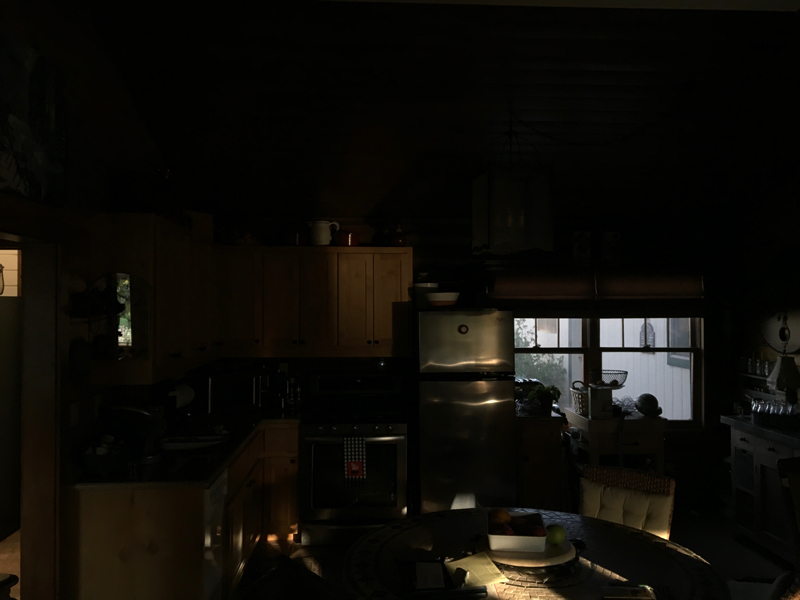
Find the location of a particular element. small window panes is located at coordinates (525, 333), (542, 334), (570, 333), (604, 333), (626, 333), (654, 334), (678, 338).